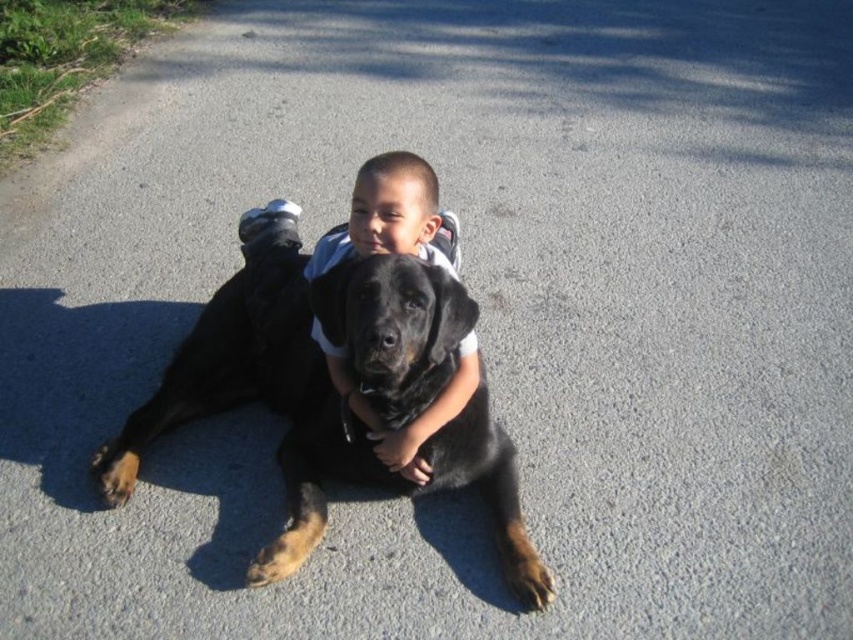
Is black fur dog at center shorter than smooth black shirt at center?

Incorrect, black fur dog at center's height does not fall short of smooth black shirt at center's.

Between black fur dog at center and smooth black shirt at center, which one appears on the left side from the viewer's perspective?

black fur dog at center is more to the left.

Where is `black fur dog at center`? The width and height of the screenshot is (853, 640). black fur dog at center is located at coordinates (303, 369).

The width and height of the screenshot is (853, 640). I want to click on black fur dog at center, so click(303, 369).